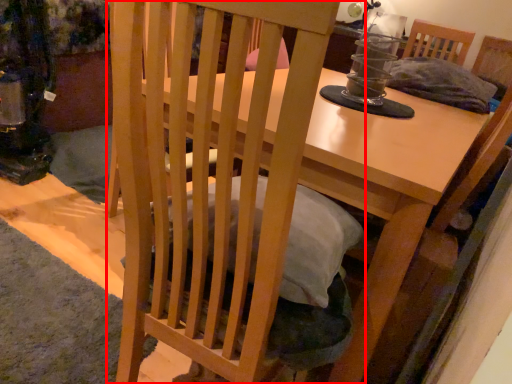
Question: From the image, what is the correct spatial relationship of chair (annotated by the red box) in relation to table?

Choices:
 (A) left
 (B) right

Answer: (A)